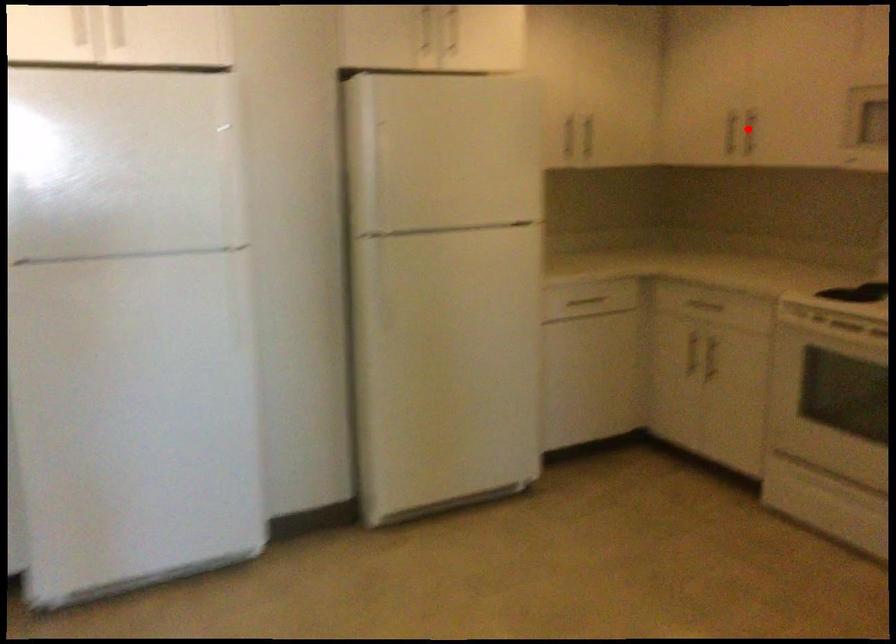
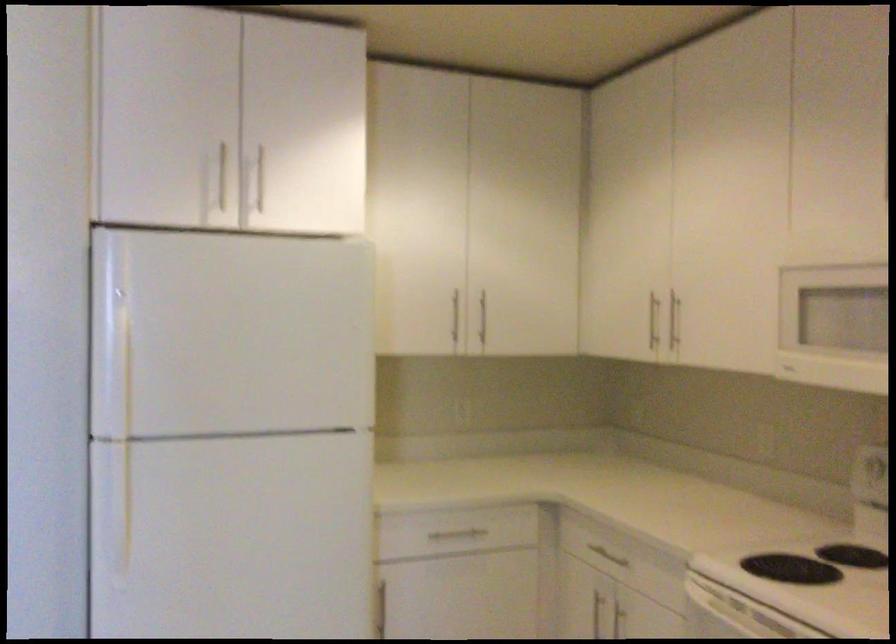
Question: I am providing you with two images of the same scene from different viewpoints. Image1 has a red point marked. In image2, the corresponding 3D location appears at what relative position? Reply with the corresponding letter.

Choices:
 (A) Closer
 (B) Farther

Answer: (A)